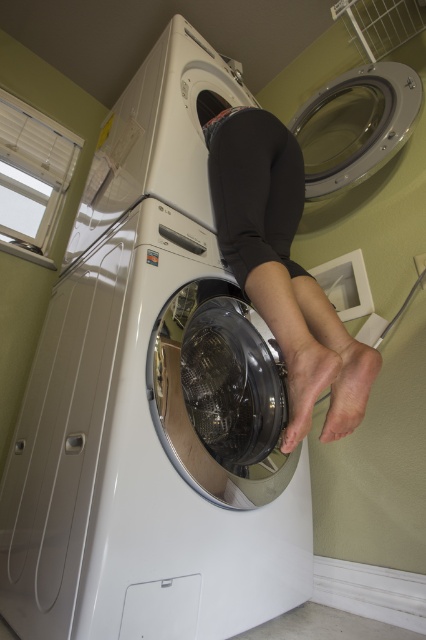
Question: Can you confirm if white glossy washing machine at center is positioned to the left of transparent glass door at center?

Choices:
 (A) yes
 (B) no

Answer: (A)

Question: In this image, where is transparent glass door at center located relative to pink smooth foot at lower right?

Choices:
 (A) left
 (B) right

Answer: (B)

Question: Estimate the real-world distances between objects in this image. Which object is farther from the white glossy washing machine at center?

Choices:
 (A) transparent glass door at center
 (B) matte black foot at lower center
 (C) pink smooth foot at lower right

Answer: (A)

Question: Can you confirm if white glossy washing machine at center is thinner than transparent glass door at center?

Choices:
 (A) yes
 (B) no

Answer: (B)

Question: Which object is closer to the camera taking this photo?

Choices:
 (A) white glossy washing machine at center
 (B) pink smooth foot at lower right
 (C) transparent glass door at center
 (D) matte black foot at lower center

Answer: (A)

Question: Among these objects, which one is nearest to the camera?

Choices:
 (A) transparent glass door at center
 (B) pink smooth foot at lower right
 (C) matte black foot at lower center
 (D) white glossy washing machine at center

Answer: (D)